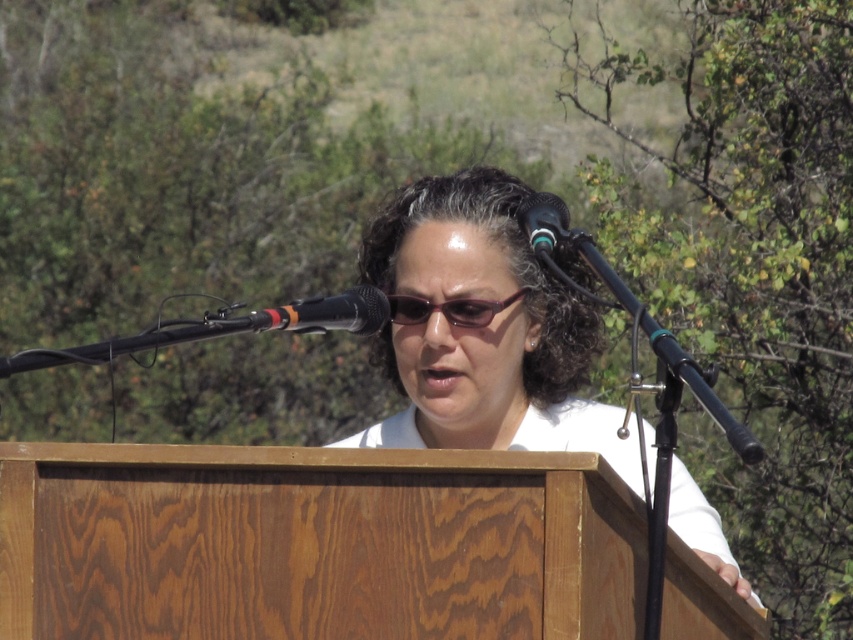
Question: Is matte white shirt at center smaller than purple shiny glasses at center?

Choices:
 (A) yes
 (B) no

Answer: (B)

Question: Does purple shiny glasses at center have a smaller size compared to black plastic microphone at upper center?

Choices:
 (A) yes
 (B) no

Answer: (A)

Question: Does purple shiny glasses at center lie in front of black plastic microphone at upper center?

Choices:
 (A) no
 (B) yes

Answer: (A)

Question: Which object is positioned farthest from the matte white shirt at center?

Choices:
 (A) black metallic microphone at center
 (B) purple shiny glasses at center

Answer: (A)

Question: Which object appears closest to the camera in this image?

Choices:
 (A) matte white shirt at center
 (B) black metallic microphone at center
 (C) black plastic microphone at upper center

Answer: (B)

Question: Which object is the closest to the black plastic microphone at upper center?

Choices:
 (A) matte white shirt at center
 (B) purple shiny glasses at center

Answer: (A)